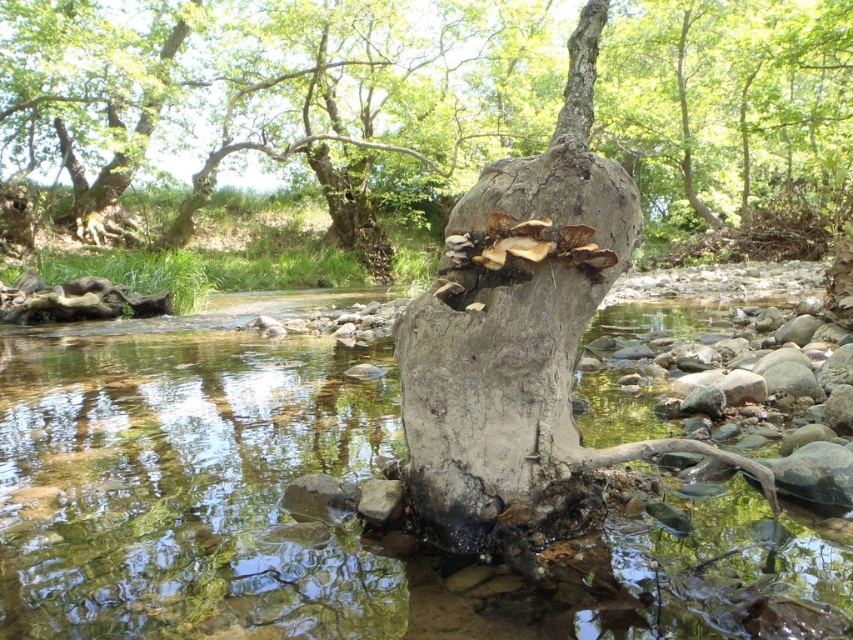
Question: Which of the following is the farthest from the observer?

Choices:
 (A) translucent water at tree center
 (B) gray rough bark tree trunk at center

Answer: (B)

Question: Does smooth gray tree trunk at center have a greater width compared to gray rough bark tree trunk at center?

Choices:
 (A) no
 (B) yes

Answer: (B)

Question: Considering the real-world distances, which object is farthest from the translucent water at tree center?

Choices:
 (A) gray rough bark tree trunk at center
 (B) smooth gray tree trunk at center

Answer: (B)

Question: Among these points, which one is nearest to the camera?

Choices:
 (A) (686, 8)
 (B) (711, 624)
 (C) (587, 177)

Answer: (B)

Question: Is translucent water at tree center bigger than smooth gray tree trunk at center?

Choices:
 (A) no
 (B) yes

Answer: (A)

Question: Is translucent water at tree center closer to camera compared to gray rough bark tree trunk at center?

Choices:
 (A) yes
 (B) no

Answer: (A)